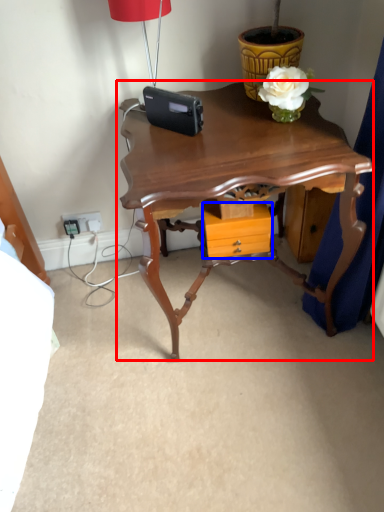
Question: Which of the following is the closest to the observer, table (highlighted by a red box) or drawer (highlighted by a blue box)?

Choices:
 (A) table
 (B) drawer

Answer: (A)